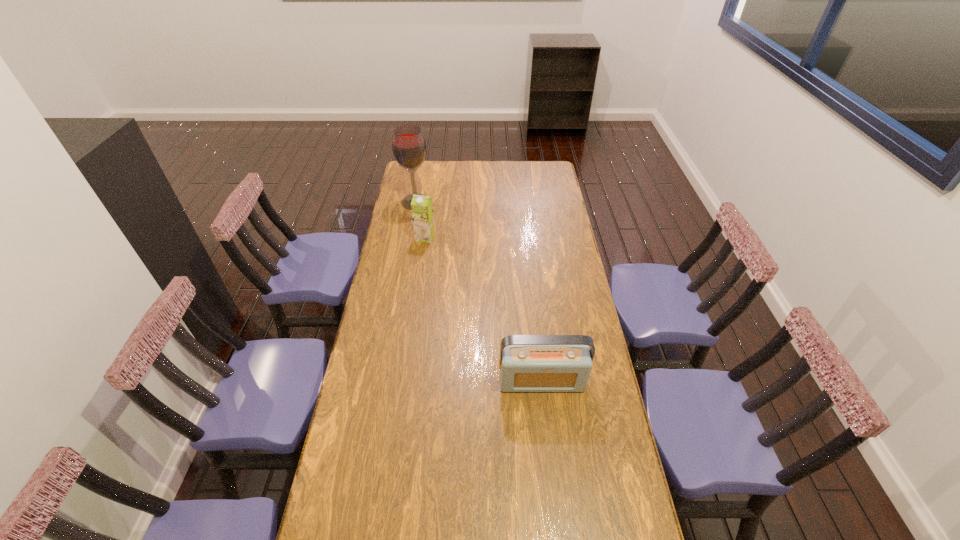
Locate an element on the screen. object situated at the right edge is located at coordinates (528, 363).

The height and width of the screenshot is (540, 960). Identify the location of vacant space at the far edge of the desktop. (516, 172).

Locate an element on the screen. blank space at the left edge is located at coordinates (372, 409).

The image size is (960, 540). Identify the location of vacant point at the right edge. (595, 506).

At what (x,y) coordinates should I click in order to perform the action: click on blank space at the far left corner of the desktop. Please return your answer as a coordinate pair (x, y). Image resolution: width=960 pixels, height=540 pixels. Looking at the image, I should click on (430, 176).

At what (x,y) coordinates should I click in order to perform the action: click on free space between the rightmost object and the tallest object. Please return your answer as a coordinate pair (x, y). The width and height of the screenshot is (960, 540). Looking at the image, I should click on (479, 292).

Identify which object is the nearest to the farthest object. Please provide its 2D coordinates. Your answer should be formatted as a tuple, i.e. [(x, y)], where the tuple contains the x and y coordinates of a point satisfying the conditions above.

[(421, 206)]

Identify which object is the closest to the farthest object. Please provide its 2D coordinates. Your answer should be formatted as a tuple, i.e. [(x, y)], where the tuple contains the x and y coordinates of a point satisfying the conditions above.

[(421, 206)]